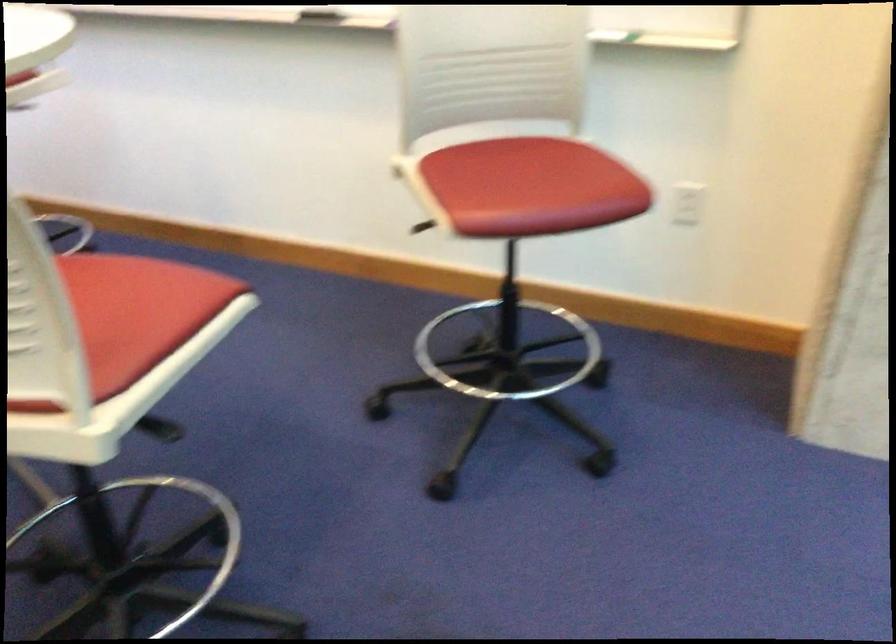
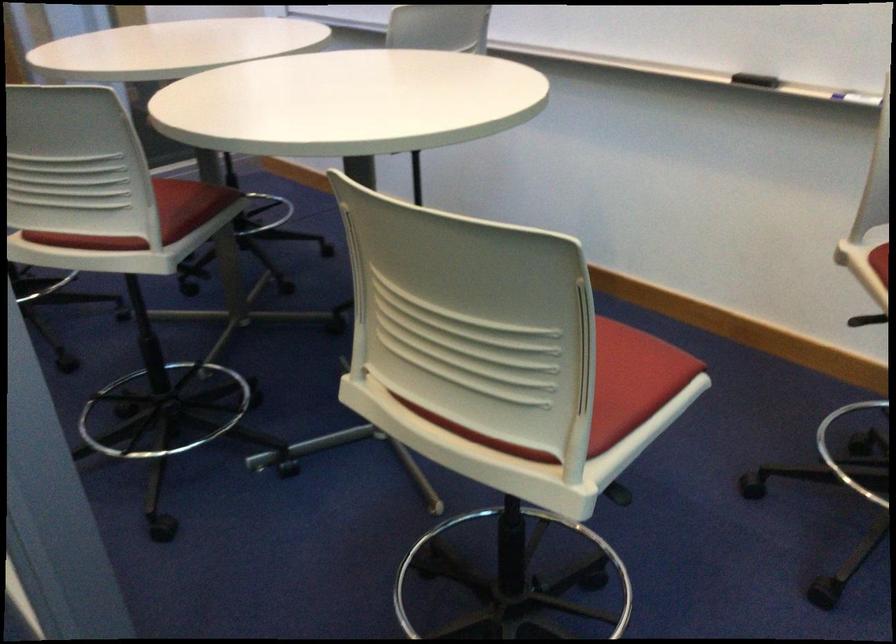
Find the pixel in the second image that matches [425,165] in the first image.

(880, 261)